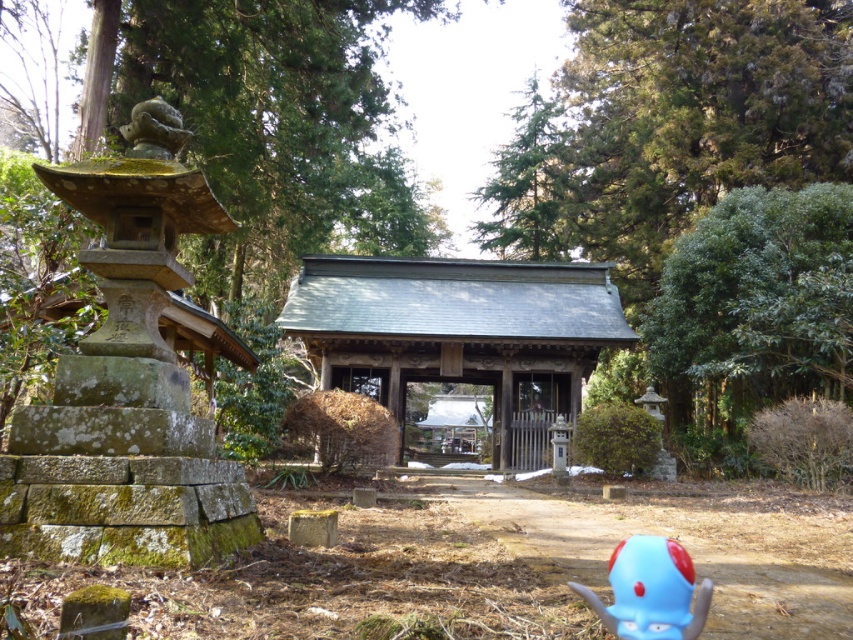
Measure the distance between gray/wooden hut at center and camera.

gray/wooden hut at center and camera are 59.34 feet apart from each other.

Is point (578, 337) closer to viewer compared to point (509, 214)?

Yes, it is in front of point (509, 214).

The height and width of the screenshot is (640, 853). In order to click on gray/wooden hut at center in this screenshot , I will do `click(460, 333)`.

The image size is (853, 640). Find the location of `gray/wooden hut at center`. gray/wooden hut at center is located at coordinates (460, 333).

Who is lower down, mossy stone lantern at left or green leafy tree at right?

green leafy tree at right is lower down.

Which is behind, point (171, 461) or point (715, 340)?

The point (715, 340) is behind.

The height and width of the screenshot is (640, 853). I want to click on mossy stone lantern at left, so click(126, 384).

Is mossy stone lantern at left shorter than gray/wooden hut at center?

Correct, mossy stone lantern at left is not as tall as gray/wooden hut at center.

Between point (195, 177) and point (434, 269), which one is positioned behind?

The point (434, 269) is more distant.

Is point (132, 280) positioned before point (339, 376)?

That is True.

This screenshot has width=853, height=640. What are the coordinates of `mossy stone lantern at left` in the screenshot? It's located at (126, 384).